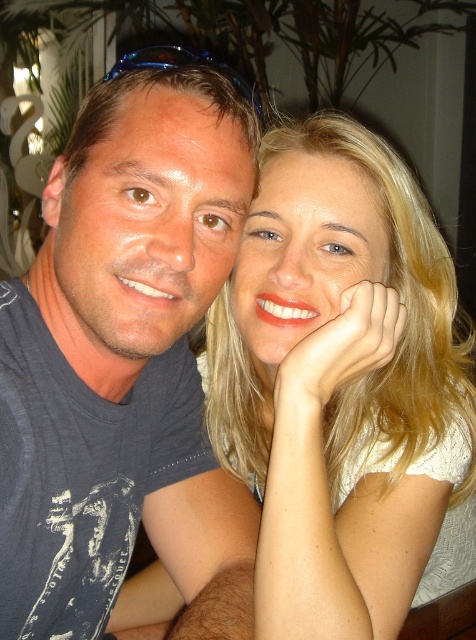
Is dark blue t-shirt at left above smooth blonde hair at center?

No.

Which is above, dark blue t-shirt at left or smooth blonde hair at center?

smooth blonde hair at center is higher up.

Which is behind, point (39, 381) or point (297, 604)?

Positioned behind is point (39, 381).

Find the location of a particular element. The height and width of the screenshot is (640, 476). dark blue t-shirt at left is located at coordinates click(x=125, y=364).